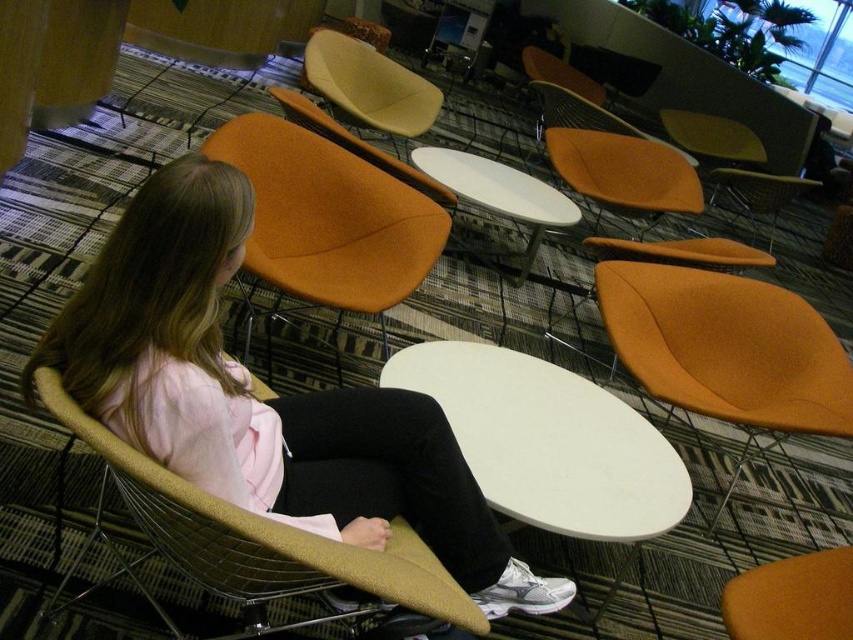
Can you confirm if matte orange chair at center is thinner than orange fabric chair at center?

Incorrect, matte orange chair at center's width is not less than orange fabric chair at center's.

Is matte orange chair at center behind orange fabric chair at center?

No, it is not.

Which is behind, point (207, 225) or point (363, 147)?

The point (363, 147) is behind.

Locate an element on the screen. This screenshot has width=853, height=640. matte orange chair at center is located at coordinates (264, 401).

Does matte gold chair at center have a lesser height compared to orange fabric chair at center?

Incorrect, matte gold chair at center's height does not fall short of orange fabric chair at center's.

Based on the photo, between matte gold chair at center and orange fabric chair at center, which one appears on the right side from the viewer's perspective?

orange fabric chair at center is more to the right.

Between point (111, 465) and point (299, 116), which one is positioned in front?

Point (111, 465)

This screenshot has height=640, width=853. I want to click on matte gold chair at center, so click(258, 536).

Does matte orange chair at center have a larger size compared to orange fabric armchair at left?

Incorrect, matte orange chair at center is not larger than orange fabric armchair at left.

Is matte orange chair at center behind orange fabric armchair at left?

No.

Which is in front, point (100, 400) or point (281, 166)?

Point (100, 400)

The width and height of the screenshot is (853, 640). What are the coordinates of `matte orange chair at center` in the screenshot? It's located at coord(264,401).